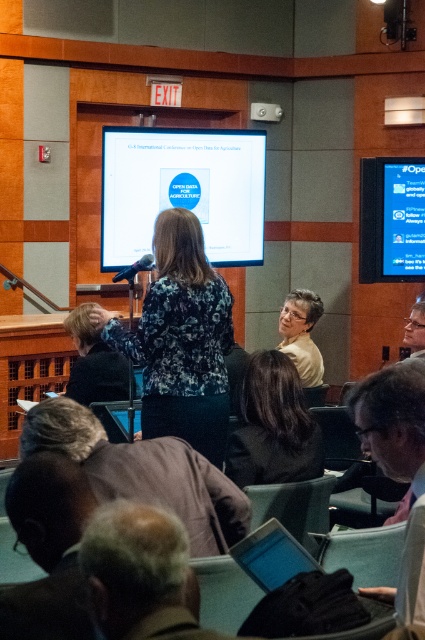
You are sitting in the front row of the conference hall and notice two points marked on the stage. The first point is at coordinates point (108, 234) and the second is at point (187, 266). Which point appears closer to you?

Point (108, 234) is closer to you because it is further to the viewer than point (187, 266).

You are sitting in the front row of the conference hall and notice the brown fabric jacket at lower left. If you want to hand a note to the person wearing it, which direction should you face?

The brown fabric jacket at lower left is located at point (x=144, y=472), so you should face towards the lower left direction to hand the note.

You are an attendee sitting in the front row of the conference hall. You want to take a photo of the stage with your phone. To ensure the white glossy projection screen at upper center is centered in your photo, where should you aim your camera? Use the coordinate system provided in the description to specify the position.

You should aim your camera at the coordinates point [183,189] to center the white glossy projection screen at upper center in your photo.